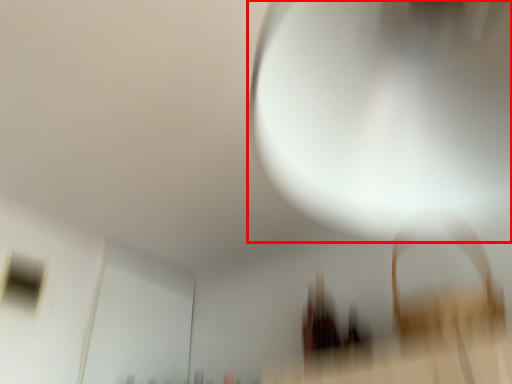
Question: From the image's perspective, what is the correct spatial relationship of light (annotated by the red box) in relation to window?

Choices:
 (A) above
 (B) below

Answer: (A)